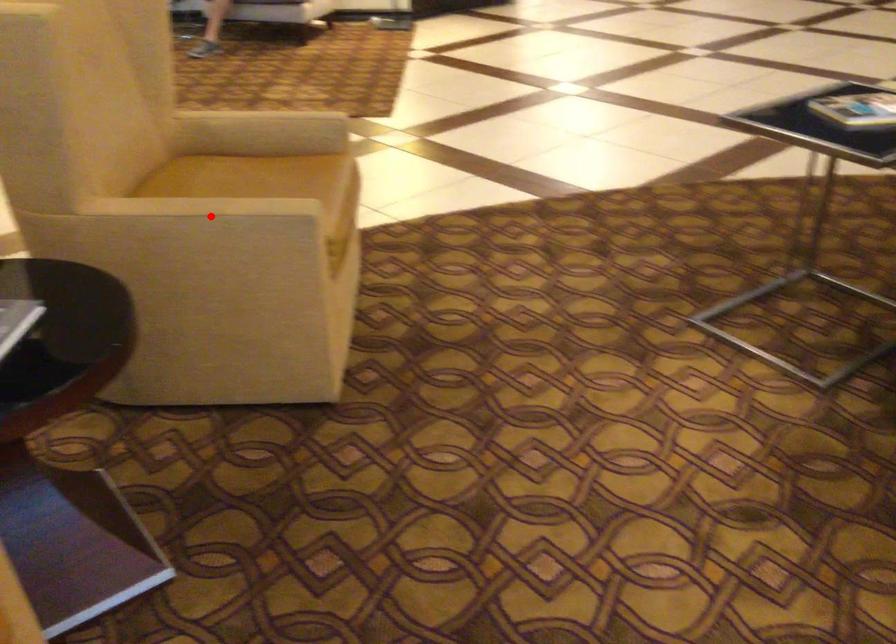
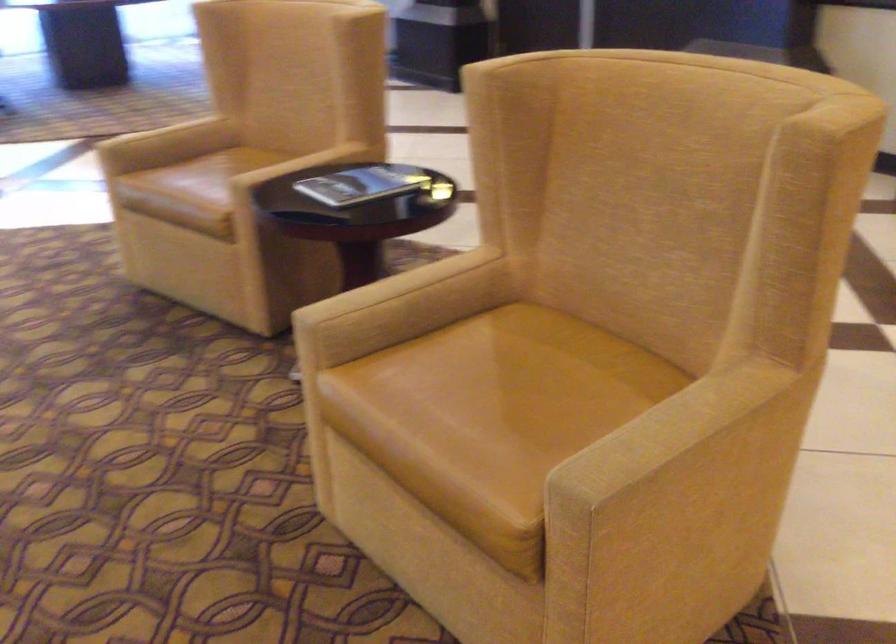
Locate, in the second image, the point that corresponds to the highlighted location in the first image.

(394, 286)